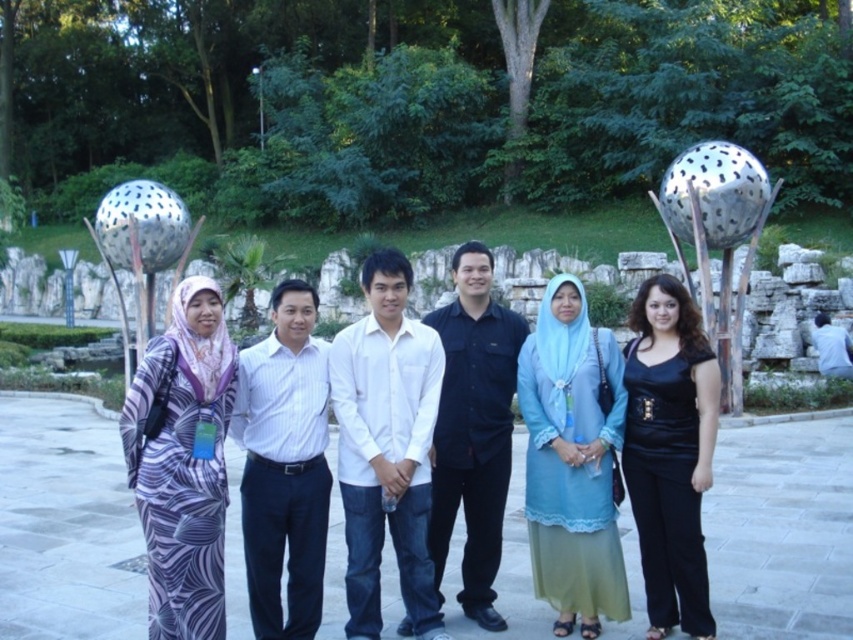
You are a photographer trying to capture a group photo of the scene described. You want to ensure that the white cotton shirt at center and the black leather pants at right are both clearly visible in the frame. Based on their positions, which one should you focus on first to ensure both are in focus?

Since the white cotton shirt at center is to the left of the black leather pants at right, you should focus on the white cotton shirt at center first, as it is closer to the camera, ensuring both will be in focus.